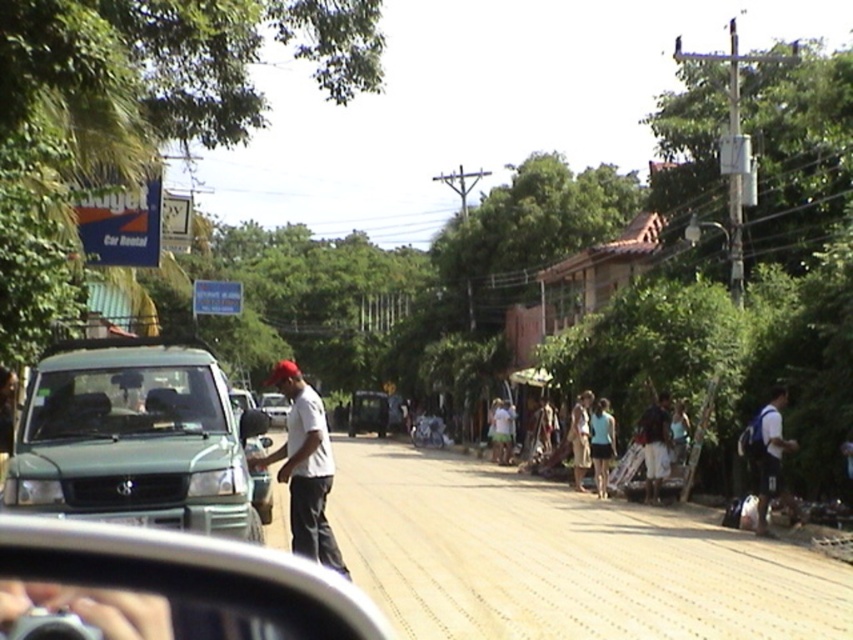
Question: Which point is farther to the camera?

Choices:
 (A) pos(132,397)
 (B) pos(175,573)

Answer: (A)

Question: Which of the following is the closest to the observer?

Choices:
 (A) click(x=610, y=445)
 (B) click(x=260, y=403)
 (C) click(x=204, y=369)
 (D) click(x=349, y=604)

Answer: (D)

Question: Can you confirm if green matte suv at center-left is positioned below light brown fabric dress at center-right?

Choices:
 (A) yes
 (B) no

Answer: (B)

Question: Which object is positioned farthest from the metallic silver car at center?

Choices:
 (A) white matte shirt at center
 (B) green matte suv at center-left
 (C) white fabric backpack at right
 (D) transparent glass windshield at center

Answer: (D)

Question: Does green matte suv at center-left lie behind silver metallic view mirror at lower left?

Choices:
 (A) yes
 (B) no

Answer: (A)

Question: Is white fabric backpack at right further to the viewer compared to metallic silver car at center?

Choices:
 (A) no
 (B) yes

Answer: (A)